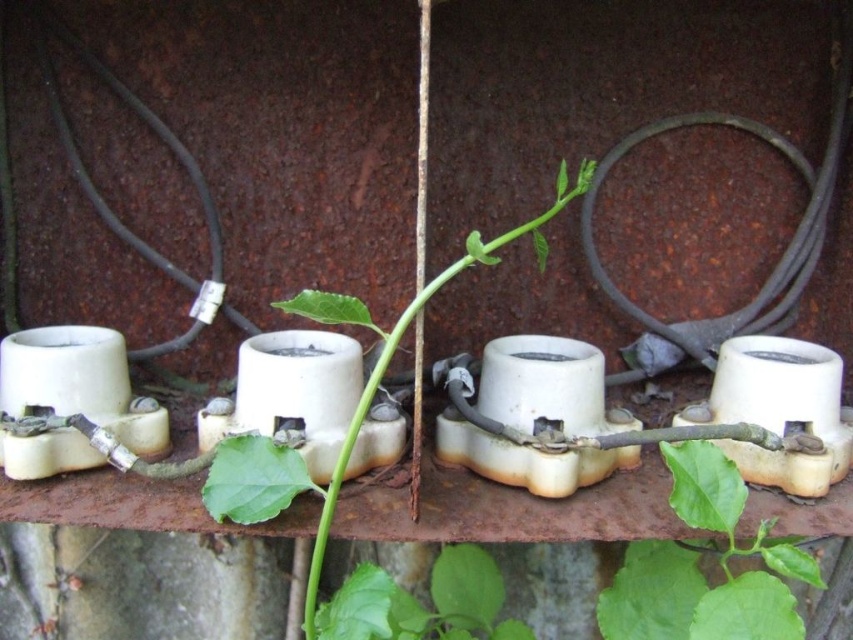
You are a maintenance worker inspecting the electrical box. You notice the green matte leaf at center and the green leafy plant at center. How far apart are they?

The green matte leaf at center is 22.57 centimeters from the green leafy plant at center.

You are a maintenance worker inspecting the electrical box. You notice two green elements at the center of the box. Which one is nearer to you, the green matte leaf at center or the green leafy plant at center?

The green matte leaf at center is closer to the viewer than the green leafy plant at center, so the green matte leaf at center is nearer to you.

You are a maintenance worker inspecting the electrical box. You notice the green matte leaf at center and the green leafy plant at center. Which one is narrower in width?

The green matte leaf at center has a lesser width compared to the green leafy plant at center, so the green matte leaf at center is narrower in width.